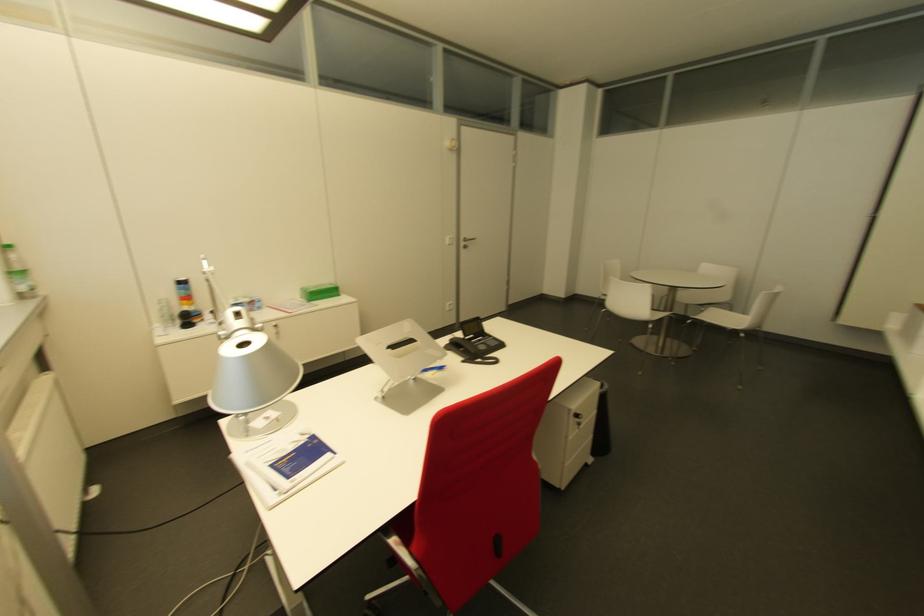
Find where to pull the silver door handle. Please return your answer as a coordinate pair (x, y).

(467, 241)